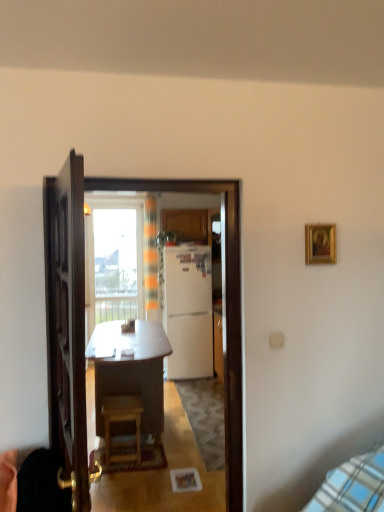
What is the approximate width of white matte refrigerator at center?

25.38 inches.

In order to face gold-framed picture at upper right, should I rotate leftwards or rightwards?

Turn right approximately 17.021 degrees to face it.

Describe the element at coordinates (83, 313) in the screenshot. I see `white glossy refrigerator at center` at that location.

The height and width of the screenshot is (512, 384). Describe the element at coordinates (120, 421) in the screenshot. I see `wooden stool at center` at that location.

What are the coordinates of `matte wood cabinet at center` in the screenshot? It's located at (186, 224).

You are a GUI agent. You are given a task and a screenshot of the screen. Output one action in this format:
    pyautogui.click(x=<x>, y=<y>)
    Task: Click on the wooden desk at center
    The width and height of the screenshot is (384, 512).
    Given the screenshot: What is the action you would take?
    pyautogui.click(x=130, y=370)

What is the approximate width of wooden door at center?

12.40 centimeters.

Locate an element on the screen. The height and width of the screenshot is (512, 384). white matte refrigerator at center is located at coordinates (188, 311).

Identify the location of door that is under the matte wood cabinet at center (from a real-world perspective). (67, 323).

Based on the photo, what's the angular difference between wooden door at center and matte wood cabinet at center's facing directions?

The angular difference between wooden door at center and matte wood cabinet at center is 103 degrees.

Can you confirm if wooden door at center is bigger than matte wood cabinet at center?

Indeed, wooden door at center has a larger size compared to matte wood cabinet at center.

Can we say wooden door at center lies outside matte wood cabinet at center?

Yes, wooden door at center is located beyond the bounds of matte wood cabinet at center.

Considering the sizes of objects transparent glass window at upper center and wooden stool at center in the image provided, who is thinner, transparent glass window at upper center or wooden stool at center?

transparent glass window at upper center is thinner.

Is wooden stool at center completely or partially inside transparent glass window at upper center?

Definitely not — wooden stool at center is not inside transparent glass window at upper center.

In the scene shown: Is transparent glass window at upper center beside wooden stool at center?

There is a gap between transparent glass window at upper center and wooden stool at center.

Considering the relative sizes of transparent glass window at upper center and wooden stool at center in the image provided, is transparent glass window at upper center bigger than wooden stool at center?

Correct, transparent glass window at upper center is larger in size than wooden stool at center.

Between orange striped curtain at center and wooden stool at center, which one appears on the left side from the viewer's perspective?

wooden stool at center is more to the left.

The height and width of the screenshot is (512, 384). I want to click on curtain that appears above the wooden stool at center (from the image's perspective), so click(x=150, y=258).

From a real-world perspective, is orange striped curtain at center on wooden stool at center?

Indeed, from a real-world perspective, orange striped curtain at center stands above wooden stool at center.

Considering the sizes of objects white matte refrigerator at center and wooden desk at center in the image provided, who is bigger, white matte refrigerator at center or wooden desk at center?

wooden desk at center.

Can you see white matte refrigerator at center touching wooden desk at center?

No, white matte refrigerator at center is not next to wooden desk at center.

Based on the photo, can you confirm if white matte refrigerator at center is positioned to the left of wooden desk at center?

No.

Considering their positions, is white glossy refrigerator at center located in front of or behind transparent glass window at upper center?

In the image, white glossy refrigerator at center appears in front of transparent glass window at upper center.

From the image's perspective, who appears lower, white glossy refrigerator at center or transparent glass window at upper center?

white glossy refrigerator at center.

From a real-world perspective, is white glossy refrigerator at center physically located above or below transparent glass window at upper center?

white glossy refrigerator at center is below transparent glass window at upper center.

From the picture: Is wooden desk at center completely or partially outside of matte wood cabinet at center?

wooden desk at center lies outside matte wood cabinet at center's area.

Which of these two, wooden desk at center or matte wood cabinet at center, is smaller?

matte wood cabinet at center is smaller.

From the image's perspective, is wooden desk at center located above matte wood cabinet at center?

No, from the image's perspective, wooden desk at center is not over matte wood cabinet at center.

Is matte wood cabinet at center at the back of wooden desk at center?

No, wooden desk at center is not facing away from matte wood cabinet at center.

From a real-world perspective, is matte wood cabinet at center on gold-framed picture at upper right?

Correct, in the physical world, matte wood cabinet at center is higher than gold-framed picture at upper right.

Looking at this image, who is taller, matte wood cabinet at center or gold-framed picture at upper right?

matte wood cabinet at center.

Is matte wood cabinet at center positioned far away from gold-framed picture at upper right?

matte wood cabinet at center is far away from gold-framed picture at upper right.

From the image's perspective, between matte wood cabinet at center and gold-framed picture at upper right, who is located below?

From the image's view, gold-framed picture at upper right is below.

Find the location of a particular element. Image resolution: width=384 pixels, height=512 pixels. door on the left of the matte wood cabinet at center is located at coordinates (67, 323).

Where is `window located behind the wooden stool at center`? The image size is (384, 512). window located behind the wooden stool at center is located at coordinates (118, 259).

Estimate the real-world distances between objects in this image. Which object is further from wooden door at center, transparent glass window at upper center or white matte refrigerator at center?

white matte refrigerator at center.

Considering their positions, is wooden stool at center positioned closer to orange striped curtain at center than white matte refrigerator at center?

Based on the image, wooden stool at center appears to be nearer to orange striped curtain at center.

Estimate the real-world distances between objects in this image. Which object is further from wooden desk at center, matte wood cabinet at center or gold-framed picture at upper right?

matte wood cabinet at center lies further to wooden desk at center than the other object.

From the image, which object appears to be farther from transparent glass window at upper center, wooden door at center or orange striped curtain at center?

wooden door at center is further to transparent glass window at upper center.

Estimate the real-world distances between objects in this image. Which object is further from wooden door at center, matte wood cabinet at center or wooden stool at center?

matte wood cabinet at center lies further to wooden door at center than the other object.

When comparing their distances from wooden door at center, does transparent glass window at upper center or wooden stool at center seem further?

transparent glass window at upper center is positioned further to the anchor wooden door at center.

From the image, which object appears to be nearer to matte wood cabinet at center, white matte refrigerator at center or white glossy refrigerator at center?

white matte refrigerator at center.

From the image, which object appears to be nearer to gold-framed picture at upper right, orange striped curtain at center or wooden stool at center?

The object closer to gold-framed picture at upper right is orange striped curtain at center.

This screenshot has width=384, height=512. What are the coordinates of `refrigerator positioned between wooden stool at center and orange striped curtain at center from near to far` in the screenshot? It's located at (188, 311).

Image resolution: width=384 pixels, height=512 pixels. In order to click on stool between white glossy refrigerator at center and matte wood cabinet at center in the front-back direction in this screenshot , I will do `click(120, 421)`.

The height and width of the screenshot is (512, 384). I want to click on curtain between wooden desk at center and transparent glass window at upper center in the front-back direction, so click(150, 258).

Where is `picture frame positioned between wooden door at center and white matte refrigerator at center from near to far`? The height and width of the screenshot is (512, 384). picture frame positioned between wooden door at center and white matte refrigerator at center from near to far is located at coordinates (320, 244).